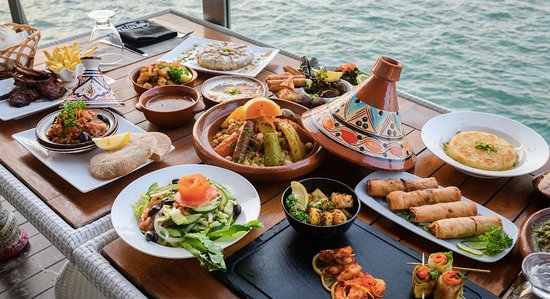
Identify the location of fork. The height and width of the screenshot is (299, 550). (183, 33).